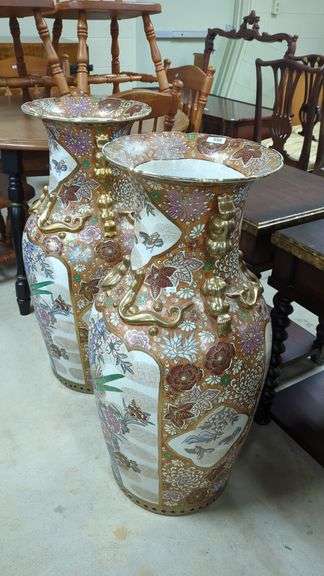
Identify the location of decorative vase. This screenshot has height=576, width=324. (194, 247), (62, 287).